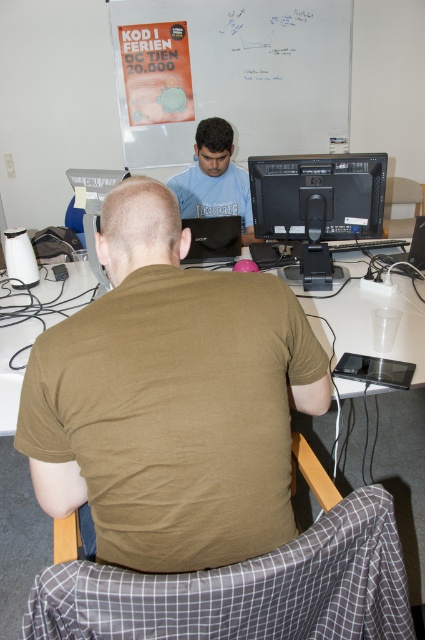
Is gray checkered fabric at back to the left of whiteboard at upper center from the viewer's perspective?

Yes, gray checkered fabric at back is to the left of whiteboard at upper center.

This screenshot has height=640, width=425. What do you see at coordinates (244, 589) in the screenshot?
I see `gray checkered fabric at back` at bounding box center [244, 589].

Which is behind, point (269, 570) or point (252, 26)?

The point (252, 26) is more distant.

Image resolution: width=425 pixels, height=640 pixels. I want to click on gray checkered fabric at back, so [x=244, y=589].

Can you confirm if gray checkered fabric at back is thinner than matte paper poster at upper center?

No.

Based on the photo, can you confirm if gray checkered fabric at back is smaller than matte paper poster at upper center?

Indeed, gray checkered fabric at back has a smaller size compared to matte paper poster at upper center.

You are a GUI agent. You are given a task and a screenshot of the screen. Output one action in this format:
    pyautogui.click(x=<x>, y=<y>)
    Task: Click on the gray checkered fabric at back
    The image size is (425, 640).
    Given the screenshot: What is the action you would take?
    pyautogui.click(x=244, y=589)

Is gray checkered fabric at back above matte blue shirt at center?

Actually, gray checkered fabric at back is below matte blue shirt at center.

The image size is (425, 640). I want to click on gray checkered fabric at back, so click(x=244, y=589).